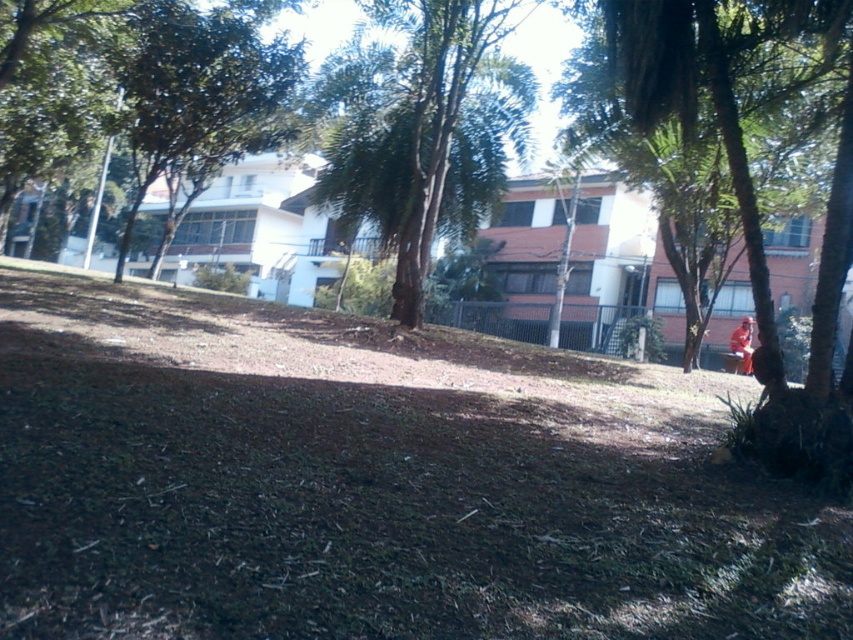
You are standing at the center of the image and want to walk towards the green leafy tree at center. Considering the sloped and uneven ground covered with dry mulch in the foreground, will you need to navigate over any obstacles before reaching the tree?

Yes, you will need to navigate over the sloped and uneven ground covered with dry mulch in the foreground before reaching the green leafy tree at center.

You are planning to plant a new tree in the foreground area. The new tree will grow to be taller than the green leafy tree at center but shorter than the green leafy tree at upper left. Based on the current scene, where should you plant the new tree so that it doesn not block the view of the taller tree at upper left when it grows?

You should plant the new tree in the foreground area between the green leafy tree at center and the green leafy tree at upper left. Since the new tree will be taller than the green leafy tree at center but shorter than the green leafy tree at upper left, placing it between them ensures it won not block the view of the taller tree at upper left.